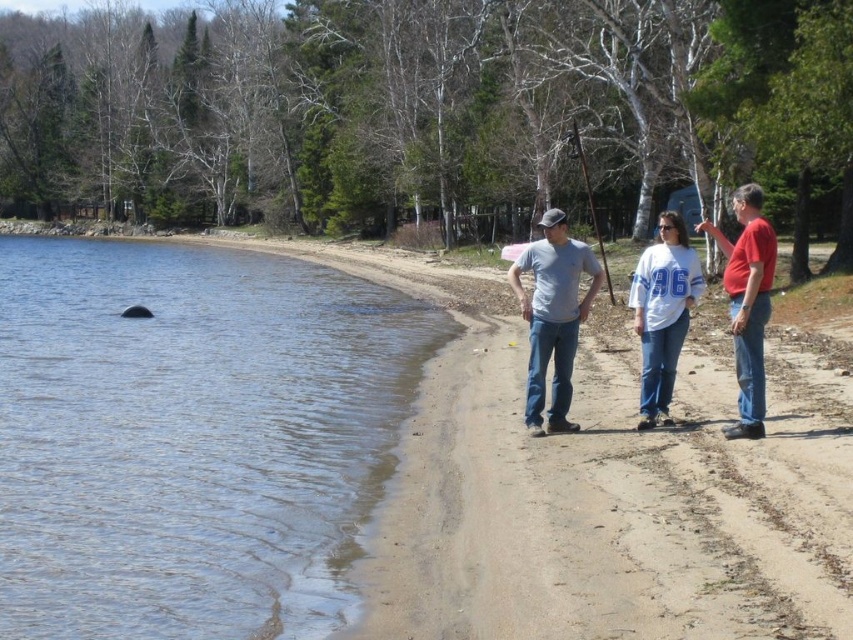
Question: Based on their relative distances, which object is farther from the gray matte t-shirt at center?

Choices:
 (A) white cotton shirt at center
 (B) white jersey at center
 (C) clear water at shore left
 (D) red cotton shirt at right

Answer: (C)

Question: Is white cotton shirt at center to the left of red cotton shirt at right from the viewer's perspective?

Choices:
 (A) no
 (B) yes

Answer: (B)

Question: Which point is farther to the camera?

Choices:
 (A) white jersey at center
 (B) gray matte t-shirt at center

Answer: (B)

Question: Does clear water at shore left appear under white cotton shirt at center?

Choices:
 (A) yes
 (B) no

Answer: (A)

Question: Considering the relative positions of white jersey at center and red cotton shirt at right in the image provided, where is white jersey at center located with respect to red cotton shirt at right?

Choices:
 (A) right
 (B) left

Answer: (B)

Question: Which of the following is the farthest from the observer?

Choices:
 (A) (660, 358)
 (B) (525, 317)

Answer: (B)